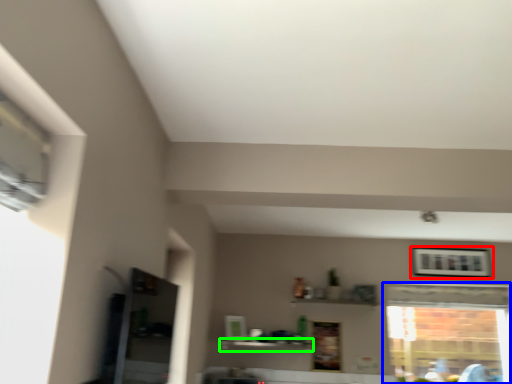
Question: Estimate the real-world distances between objects in this image. Which object is farther from picture frame (highlighted by a red box), window (highlighted by a blue box) or shelf (highlighted by a green box)?

Choices:
 (A) window
 (B) shelf

Answer: (B)